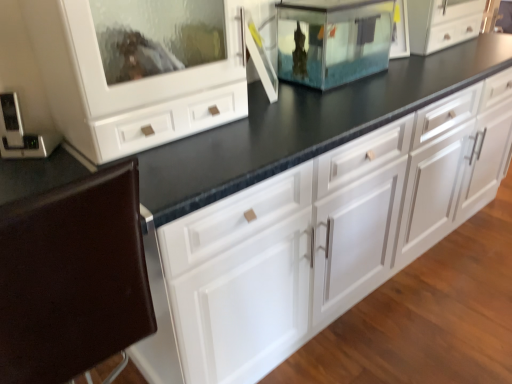
Question: Is brown leather chair at lower left at the left side of metallic silver thermostat at left, the first appliance when ordered from left to right?

Choices:
 (A) no
 (B) yes

Answer: (A)

Question: Considering the relative positions of brown leather chair at lower left and metallic silver thermostat at left, marked as the 2th appliance in a right-to-left arrangement, in the image provided, is brown leather chair at lower left to the right of metallic silver thermostat at left, marked as the 2th appliance in a right-to-left arrangement, from the viewer's perspective?

Choices:
 (A) yes
 (B) no

Answer: (A)

Question: From a real-world perspective, is brown leather chair at lower left positioned over metallic silver thermostat at left, marked as the 2th appliance in a right-to-left arrangement, based on gravity?

Choices:
 (A) no
 (B) yes

Answer: (A)

Question: Can you confirm if brown leather chair at lower left is wider than metallic silver thermostat at left, the 1th appliance in the front-to-back sequence?

Choices:
 (A) yes
 (B) no

Answer: (A)

Question: Is brown leather chair at lower left bigger than metallic silver thermostat at left, the first appliance when ordered from left to right?

Choices:
 (A) yes
 (B) no

Answer: (A)

Question: In the image, is metallic silver thermostat at left, marked as the 2th appliance in a right-to-left arrangement, positioned in front of or behind transparent glass fish tank at center, acting as the 2th appliance starting from the front?

Choices:
 (A) front
 (B) behind

Answer: (A)

Question: From the image's perspective, is metallic silver thermostat at left, marked as the 2th appliance in a right-to-left arrangement, positioned above or below transparent glass fish tank at center, the 2th appliance when ordered from left to right?

Choices:
 (A) above
 (B) below

Answer: (B)

Question: Is metallic silver thermostat at left, the 1th appliance in the front-to-back sequence, wider or thinner than transparent glass fish tank at center, which ranks as the second appliance in bottom-to-top order?

Choices:
 (A) wide
 (B) thin

Answer: (B)

Question: From a real-world perspective, is metallic silver thermostat at left, the 1th appliance in the front-to-back sequence, positioned above or below transparent glass fish tank at center, which ranks as the first appliance in top-to-bottom order?

Choices:
 (A) below
 (B) above

Answer: (A)

Question: Is transparent glass fish tank at center, arranged as the 1th appliance when viewed from the right, taller or shorter than brown leather chair at lower left?

Choices:
 (A) tall
 (B) short

Answer: (B)

Question: Based on their sizes in the image, would you say transparent glass fish tank at center, acting as the 2th appliance starting from the front, is bigger or smaller than brown leather chair at lower left?

Choices:
 (A) big
 (B) small

Answer: (B)

Question: Based on their positions, is transparent glass fish tank at center, acting as the 2th appliance starting from the front, located to the left or right of brown leather chair at lower left?

Choices:
 (A) right
 (B) left

Answer: (A)

Question: Considering their positions, is transparent glass fish tank at center, which ranks as the second appliance in bottom-to-top order, located in front of or behind brown leather chair at lower left?

Choices:
 (A) front
 (B) behind

Answer: (B)

Question: Is transparent glass fish tank at center, the 2th appliance when ordered from left to right, taller or shorter than metallic silver thermostat at left, the second appliance in the back-to-front sequence?

Choices:
 (A) short
 (B) tall

Answer: (B)

Question: Looking at the image, does transparent glass fish tank at center, the 2th appliance when ordered from left to right, seem bigger or smaller compared to metallic silver thermostat at left, which appears as the 1th appliance when ordered from the bottom?

Choices:
 (A) small
 (B) big

Answer: (B)